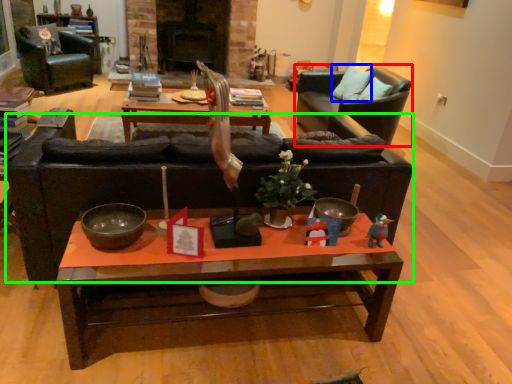
Question: Estimate the real-world distances between objects in this image. Which object is farther from chair (highlighted by a red box), pillow (highlighted by a blue box) or studio couch (highlighted by a green box)?

Choices:
 (A) pillow
 (B) studio couch

Answer: (B)